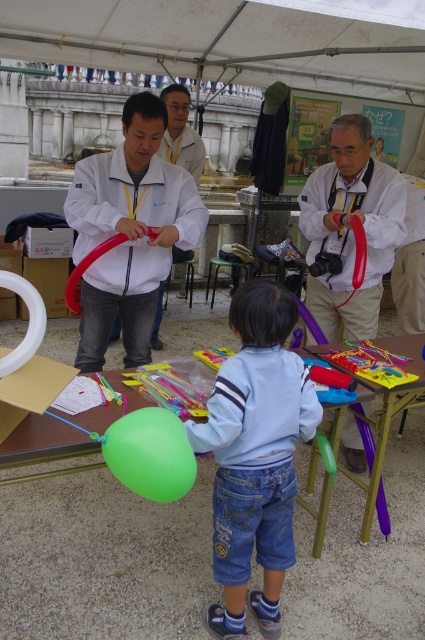
Question: Which point is closer to the camera?

Choices:
 (A) (124, 452)
 (B) (113, 154)

Answer: (A)

Question: Is the position of matte white jacket at center less distant than that of matte white balloon at center?

Choices:
 (A) no
 (B) yes

Answer: (B)

Question: Which of these objects is positioned closest to the green rubber balloon at lower center?

Choices:
 (A) light blue denim pants at center
 (B) matte white jacket at center
 (C) matte white coat at center
 (D) matte white balloon at center

Answer: (A)

Question: Is the position of matte white jacket at center less distant than that of green rubber balloon at lower center?

Choices:
 (A) yes
 (B) no

Answer: (B)

Question: Is light blue denim pants at center to the right of matte white jacket at center from the viewer's perspective?

Choices:
 (A) no
 (B) yes

Answer: (B)

Question: Which point is closer to the camera?

Choices:
 (A) (85, 230)
 (B) (187, 108)
 (C) (263, 621)
 (D) (311, 216)

Answer: (C)